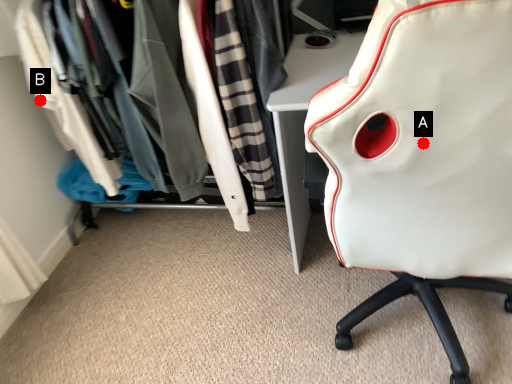
Question: Two points are circled on the image, labeled by A and B beside each circle. Among these points, which one is farthest from the camera?

Choices:
 (A) A is further
 (B) B is further

Answer: (B)